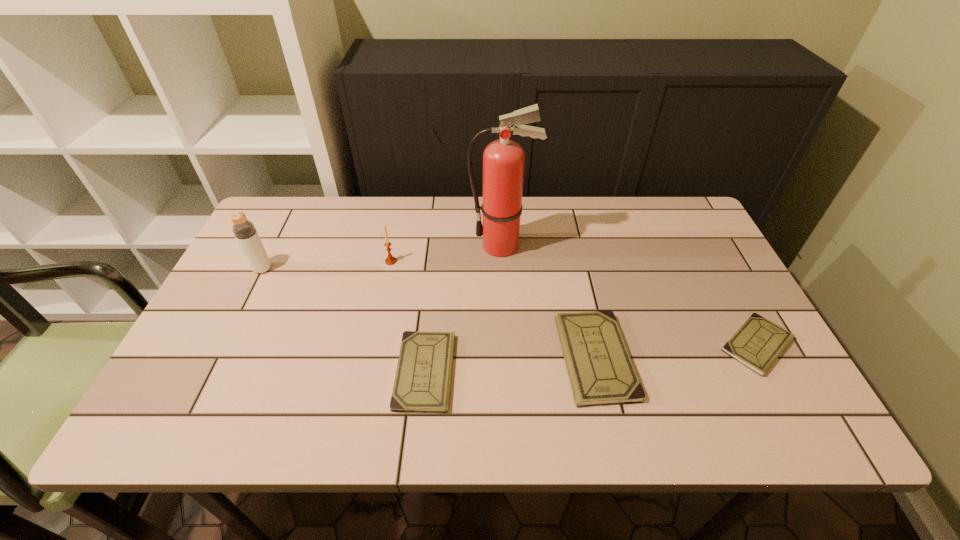
Locate an element on the screen. the second shortest object is located at coordinates (422, 382).

Identify the location of the second shortest checkbook. (422, 382).

This screenshot has height=540, width=960. What are the coordinates of `the tallest checkbook` in the screenshot? It's located at (601, 372).

Where is `the second checkbook from right to left`? The image size is (960, 540). the second checkbook from right to left is located at coordinates (601, 372).

Identify the location of the shortest checkbook. (758, 343).

Locate an element on the screen. This screenshot has height=540, width=960. the shortest object is located at coordinates (758, 343).

Identify the location of fire extinguisher. This screenshot has width=960, height=540. (503, 160).

Find the location of a particular element. the tallest object is located at coordinates (503, 160).

Locate an element on the screen. The height and width of the screenshot is (540, 960). the third tallest object is located at coordinates (390, 260).

Locate an element on the screen. the fifth object from right to left is located at coordinates (390, 260).